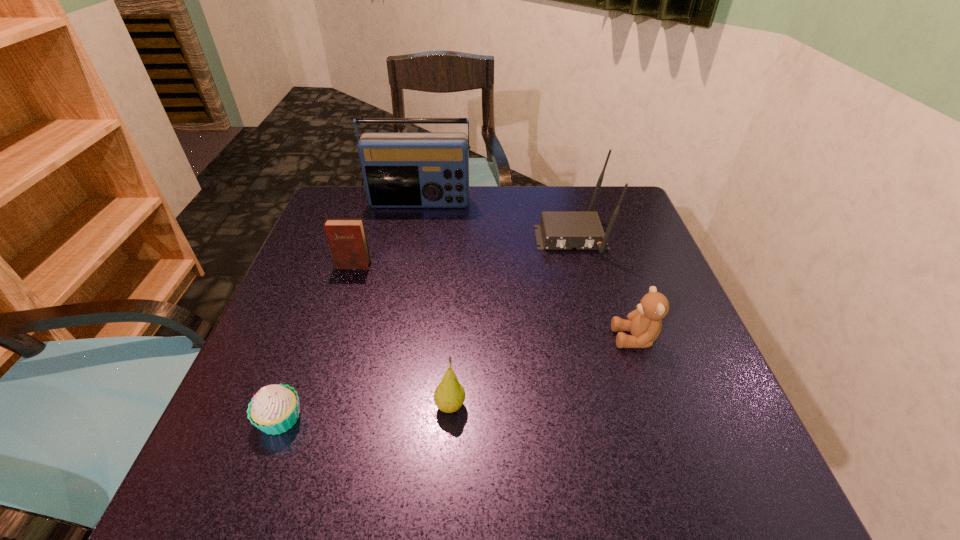
At what (x,y) coordinates should I click in order to perform the action: click on vacant position located on the front cover of the third farthest object. Please return your answer as a coordinate pair (x, y). Looking at the image, I should click on (320, 368).

Where is `free region located 0.070m on the front-facing side of the teddy bear`? Image resolution: width=960 pixels, height=540 pixels. free region located 0.070m on the front-facing side of the teddy bear is located at coordinates (578, 338).

Identify the location of blank space located 0.220m on the front-facing side of the teddy bear. Image resolution: width=960 pixels, height=540 pixels. (502, 338).

Where is `vacant point located on the front-facing side of the teddy bear`? This screenshot has height=540, width=960. vacant point located on the front-facing side of the teddy bear is located at coordinates point(588,338).

Image resolution: width=960 pixels, height=540 pixels. In order to click on vacant area situated on the right of the pear in this screenshot , I will do `click(517, 406)`.

The image size is (960, 540). I want to click on vacant space located on the back of the cupcake, so click(x=306, y=348).

Where is `radio receiver situated at the far edge`? radio receiver situated at the far edge is located at coordinates (400, 169).

Find the location of a particular element. This screenshot has width=960, height=540. router that is at the far edge is located at coordinates (557, 230).

This screenshot has height=540, width=960. Identify the location of radio receiver that is positioned at the left edge. (400, 169).

Locate an element on the screen. This screenshot has height=540, width=960. diary located at the left edge is located at coordinates (347, 240).